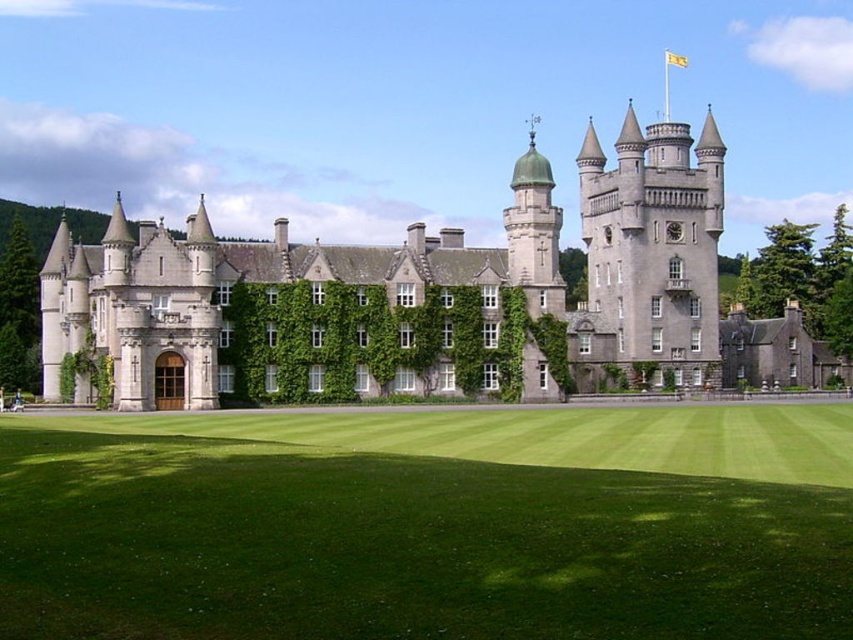
Question: Can you confirm if green grass at center is bigger than green grass at lower center?

Choices:
 (A) yes
 (B) no

Answer: (A)

Question: Among these points, which one is nearest to the camera?

Choices:
 (A) (389, 358)
 (B) (254, 620)

Answer: (B)

Question: Does green grass at lower center appear over green ivy at center?

Choices:
 (A) yes
 (B) no

Answer: (B)

Question: Can you confirm if green grass at lower center is wider than green ivy at center?

Choices:
 (A) yes
 (B) no

Answer: (A)

Question: Which point is farther to the camera?

Choices:
 (A) green ivy at center
 (B) green grass at center
 (C) green grass at lower center

Answer: (A)

Question: Among these objects, which one is farthest from the camera?

Choices:
 (A) green grass at lower center
 (B) green grass at center

Answer: (A)